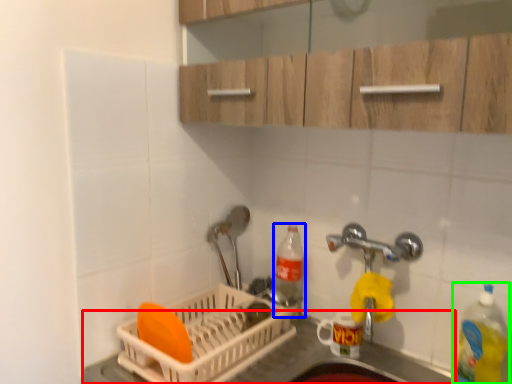
Question: Which object is positioned closest to counter top (highlighted by a red box)? Select from bottle (highlighted by a blue box) and bottle (highlighted by a green box).

Choices:
 (A) bottle
 (B) bottle

Answer: (A)